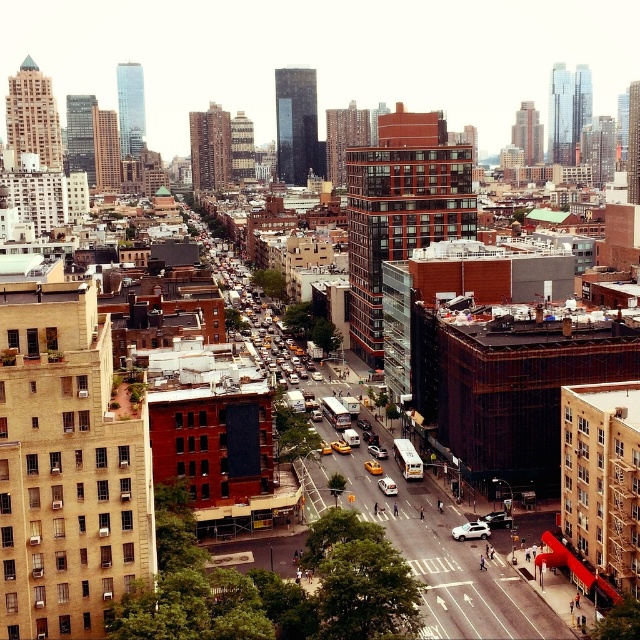
Question: Which object is closer to the camera taking this photo?

Choices:
 (A) white matte car at center
 (B) white glossy car at center

Answer: (A)

Question: Which object appears closest to the camera in this image?

Choices:
 (A) white matte car at center
 (B) white glossy car at center

Answer: (A)

Question: Is white matte car at center above white glossy car at center?

Choices:
 (A) yes
 (B) no

Answer: (B)

Question: Is white matte car at center bigger than white glossy car at center?

Choices:
 (A) yes
 (B) no

Answer: (B)

Question: Which of the following is the farthest from the observer?

Choices:
 (A) (394, 481)
 (B) (456, 538)

Answer: (A)

Question: Is white matte car at center to the right of white glossy car at center from the viewer's perspective?

Choices:
 (A) no
 (B) yes

Answer: (B)